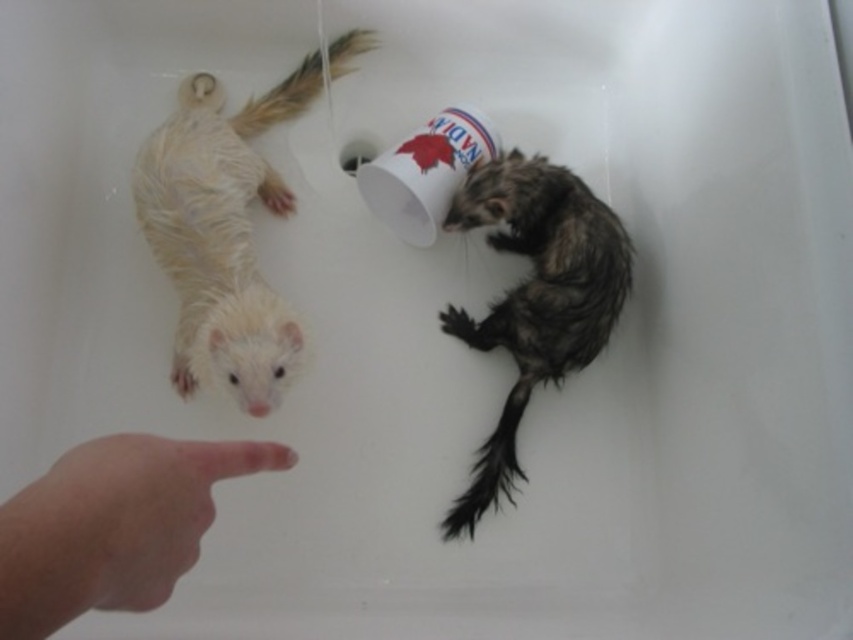
You are a photographer trying to capture a closeup shot of the ferret on the left. You have a camera with a fixed focal length and need to focus on the ferret on the left. Which of the two points, point (206, 484) or point (547, 204), is closer to the camera and should be your focus point?

Point (206, 484) is closer to the viewer than point (547, 204), so you should focus on point (206, 484) for the closeup shot of the ferret on the left.